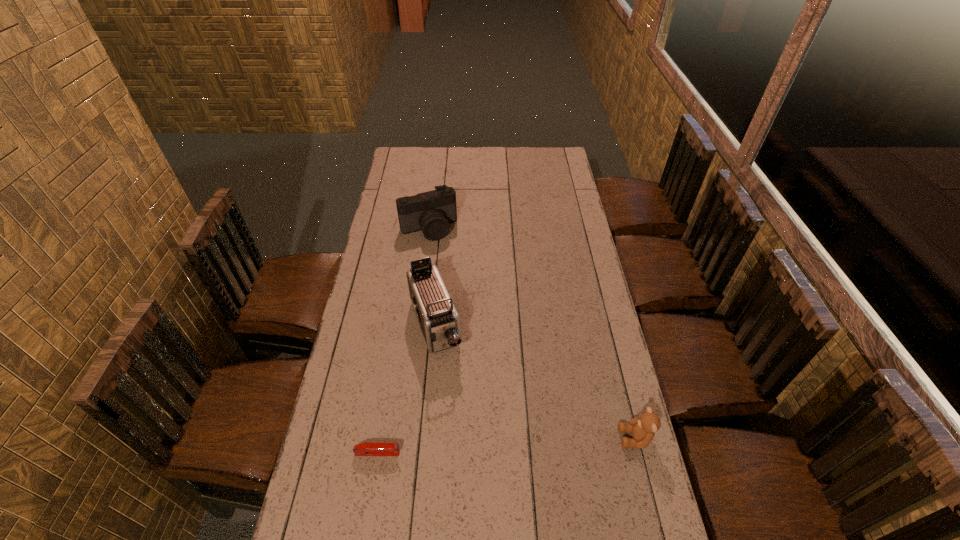
Identify the location of vacant space that is in between the stapler and the second shortest object. The height and width of the screenshot is (540, 960). (506, 446).

Locate an element on the screen. vacant space that's between the camera and the teddy bear is located at coordinates (532, 334).

Choose which object is the second nearest neighbor to the third tallest object. Please provide its 2D coordinates. Your answer should be formatted as a tuple, i.e. [(x, y)], where the tuple contains the x and y coordinates of a point satisfying the conditions above.

[(363, 449)]

Locate which object is the closest to the tallest object. Please provide its 2D coordinates. Your answer should be formatted as a tuple, i.e. [(x, y)], where the tuple contains the x and y coordinates of a point satisfying the conditions above.

[(431, 212)]

Find the location of a particular element. The width and height of the screenshot is (960, 540). vacant space that satisfies the following two spatial constraints: 1. on the front side of the second shortest object; 2. on the face of the second farthest object is located at coordinates click(x=425, y=438).